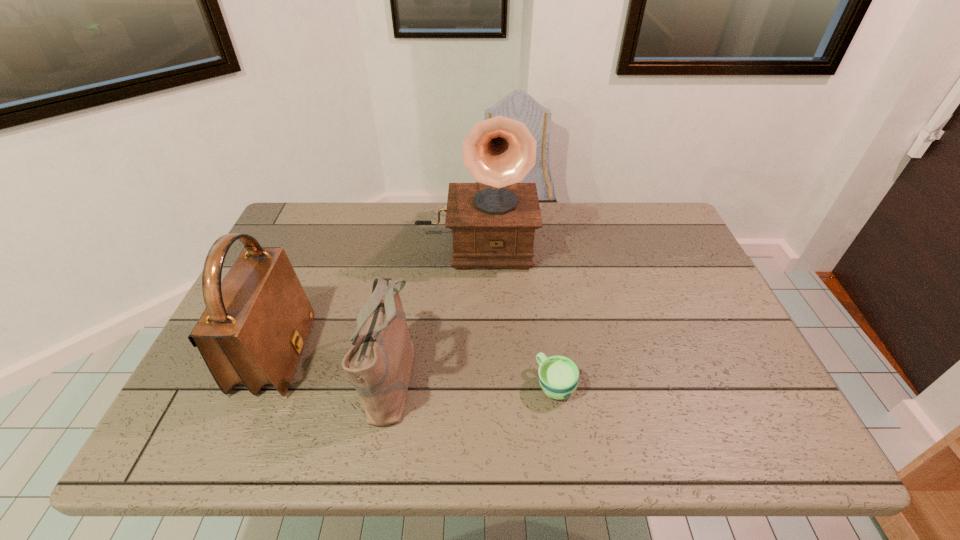
This screenshot has height=540, width=960. I want to click on record player, so click(493, 222).

You are a GUI agent. You are given a task and a screenshot of the screen. Output one action in this format:
    pyautogui.click(x=<x>, y=<y>)
    Task: Click on the tallest object
    
    Given the screenshot: What is the action you would take?
    pyautogui.click(x=493, y=222)

The width and height of the screenshot is (960, 540). I want to click on the left shoulder bag, so click(254, 327).

Locate an element on the screen. The width and height of the screenshot is (960, 540). the right shoulder bag is located at coordinates (379, 363).

This screenshot has width=960, height=540. In order to click on the shortest object in this screenshot , I will do `click(558, 376)`.

Locate an element on the screen. The width and height of the screenshot is (960, 540). vacant space situated 0.180m on the horn of the tallest object is located at coordinates (473, 325).

This screenshot has height=540, width=960. I want to click on blank space located 0.070m on the front flap of the left shoulder bag, so click(335, 355).

I want to click on free region located on the front-facing side of the right shoulder bag, so click(542, 375).

Locate an element on the screen. Image resolution: width=960 pixels, height=540 pixels. vacant region located 0.380m on the right of the shortest object is located at coordinates (748, 384).

The width and height of the screenshot is (960, 540). In order to click on object present at the far edge in this screenshot , I will do `click(493, 222)`.